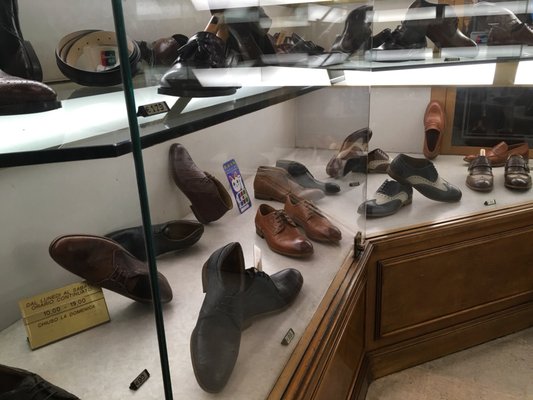
Identify the location of window. Image resolution: width=533 pixels, height=400 pixels. (x=483, y=116).